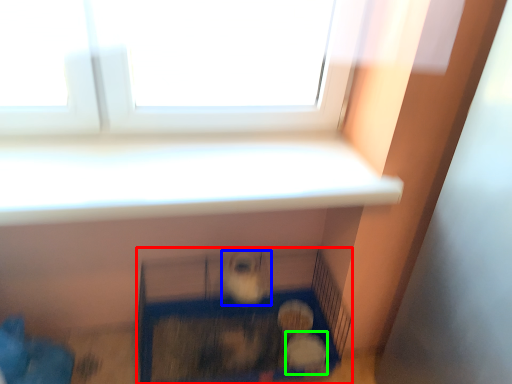
Question: Which is farther away from furniture (highlighted by a red box)? animal (highlighted by a blue box) or animal (highlighted by a green box)?

Choices:
 (A) animal
 (B) animal

Answer: (B)